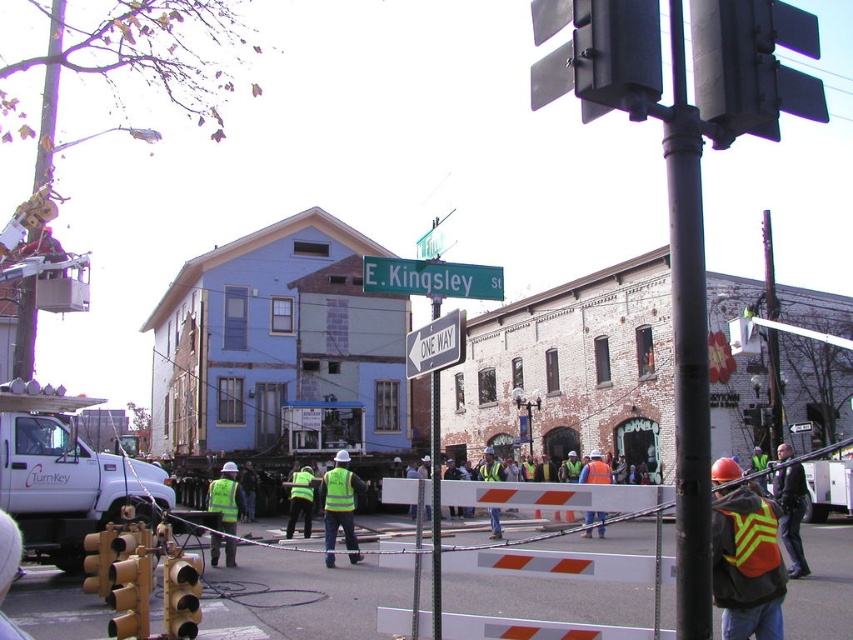
Question: Is black metal pole at upper right thinner than reflective yellow safety vest at center?

Choices:
 (A) no
 (B) yes

Answer: (A)

Question: Among these objects, which one is nearest to the camera?

Choices:
 (A) metallic gray traffic light at upper right
 (B) reflective orange vest at lower right
 (C) high-visibility yellow vest at center
 (D) reflective yellow safety vest at center

Answer: (A)

Question: Considering the real-world distances, which object is farthest from the orange reflective vest at lower right?

Choices:
 (A) metallic gray traffic light at upper right
 (B) reflective yellow-green safety vest at lower right

Answer: (A)

Question: Observing the image, what is the correct spatial positioning of black metal pole at upper right in reference to reflective yellow-green safety vest at lower right?

Choices:
 (A) left
 (B) right

Answer: (B)

Question: Which object appears closest to the camera in this image?

Choices:
 (A) metallic pole at center
 (B) reflective orange vest at lower right
 (C) reflective yellow safety vest at center
 (D) orange reflective vest at lower right

Answer: (D)

Question: Is high-visibility yellow vest at center wider than reflective yellow-green safety vest at center?

Choices:
 (A) no
 (B) yes

Answer: (B)